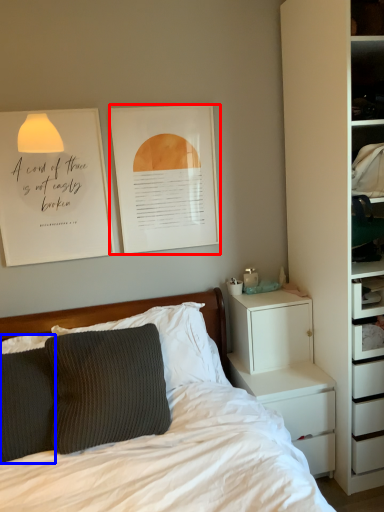
Question: Which point is closer to the camera, picture frame (highlighted by a red box) or pillow (highlighted by a blue box)?

Choices:
 (A) picture frame
 (B) pillow

Answer: (B)